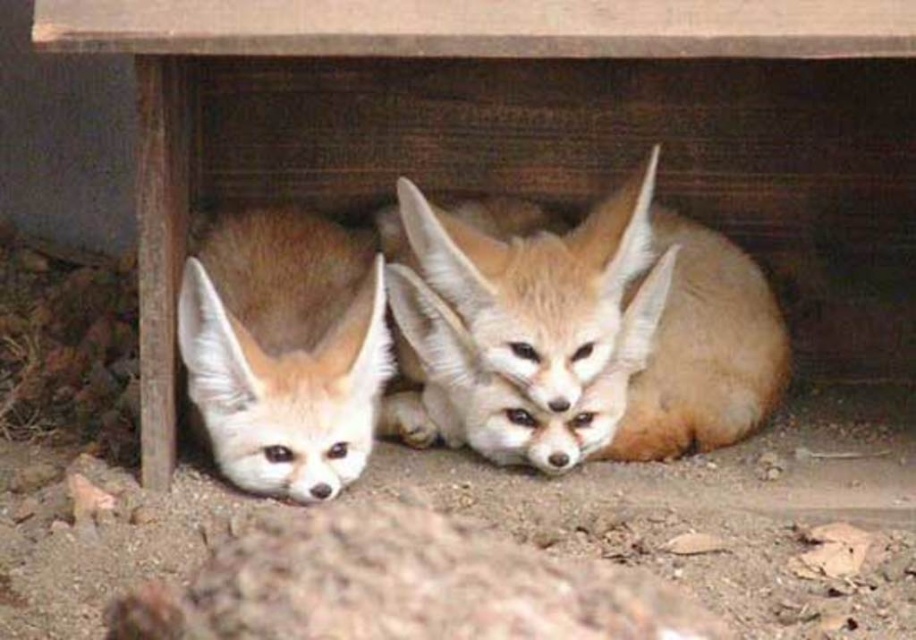
Question: Which point is farther to the camera?

Choices:
 (A) fuzzy brown fox at lower left
 (B) light brown fur at center

Answer: (B)

Question: Is light brown fur at center bigger than fuzzy brown fox at lower left?

Choices:
 (A) yes
 (B) no

Answer: (A)

Question: Is light brown fur at center in front of fuzzy brown fox at lower left?

Choices:
 (A) no
 (B) yes

Answer: (A)

Question: Is light brown fur at center closer to the viewer compared to fuzzy brown fox at lower left?

Choices:
 (A) no
 (B) yes

Answer: (A)

Question: Which point is closer to the camera?

Choices:
 (A) fuzzy brown fox at lower left
 (B) light brown fur at center

Answer: (A)

Question: Which point is closer to the camera?

Choices:
 (A) light brown fur at center
 (B) fuzzy brown fox at lower left

Answer: (B)